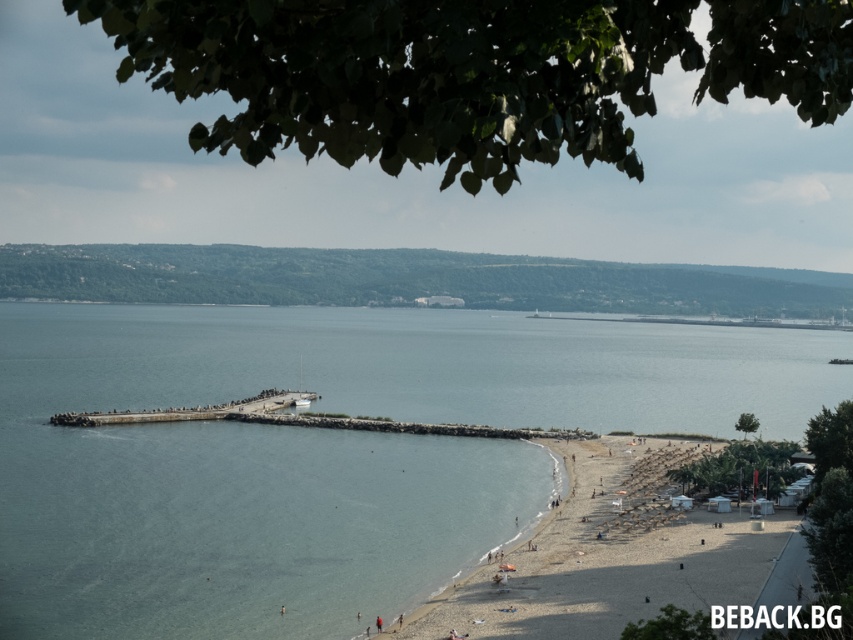
Consider the image. Can you confirm if clear blue water at center is positioned above dark gray concrete pier at center-left?

Indeed, clear blue water at center is positioned over dark gray concrete pier at center-left.

Is clear blue water at center wider than dark gray concrete pier at center-left?

Yes, clear blue water at center is wider than dark gray concrete pier at center-left.

Does point (503, 467) come closer to viewer compared to point (299, 396)?

That is True.

At what (x,y) coordinates should I click in order to perform the action: click on clear blue water at center. Please return your answer as a coordinate pair (x, y). The width and height of the screenshot is (853, 640). Looking at the image, I should click on (323, 452).

Which of these two, light brown sand at lower right or dark gray concrete pier at center-left, stands taller?

light brown sand at lower right is taller.

From the picture: Between light brown sand at lower right and dark gray concrete pier at center-left, which one is positioned lower?

light brown sand at lower right is lower down.

At what (x,y) coordinates should I click in order to perform the action: click on light brown sand at lower right. Please return your answer as a coordinate pair (x, y). The width and height of the screenshot is (853, 640). Looking at the image, I should click on (606, 556).

Can you confirm if clear blue water at center is positioned below light brown sand at lower right?

No, clear blue water at center is not below light brown sand at lower right.

Is point (32, 637) positioned in front of point (427, 611)?

Yes, point (32, 637) is in front of point (427, 611).

Find the location of a particular element. clear blue water at center is located at coordinates (323, 452).